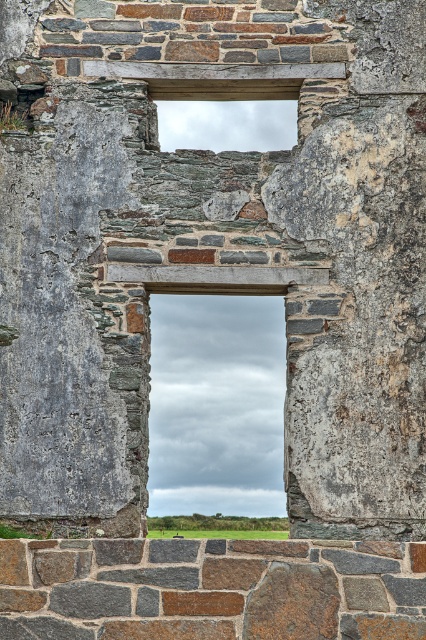
You are an architect examining the stone structure. You notice two windows made of glass. Which window would allow more natural light into the room, the transparent glass window at center or the clear glass window at upper center?

The transparent glass window at center is bigger than the clear glass window at upper center, so it would allow more natural light into the room.

You are an architect examining the stone structure and need to install a new support beam. You see the transparent glass window at center and the clear glass window at upper center. Which window should you place the beam closer to based on their positions?

The transparent glass window at center is to the left of clear glass window at upper center. Therefore, the beam should be placed closer to the transparent glass window at center since it is positioned to the left of the clear glass window at upper center.

You are standing in front of the stone structure and want to know where the transparent glass window at center is located. Can you determine its exact position using coordinates?

The transparent glass window at center is located at coordinates point (216,404).